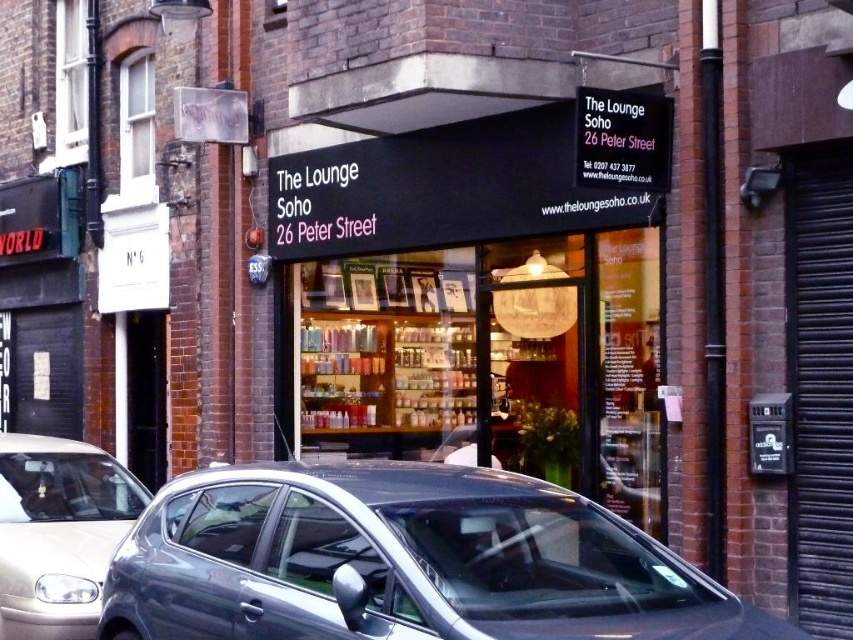
You are standing at the entrance of The Lounge Soho on 26 Peter Street and want to check if your metallic gray hatchback at lower left is within a 4 meter safety zone. Can you confirm if it is within the zone?

The metallic gray hatchback at lower left is 3.99 meters away from the camera, which is within the 4 meter safety zone.

You are a delivery person needing to park your delivery van which is 2 meters wide. You see the metallic gray hatchback at lower left and the silver metallic car at lower left. Can you park your van between them if they are parked side by side?

The metallic gray hatchback at lower left is wider than the silver metallic car at lower left. Since the van is 2 meters wide, you need to check the combined width of both vehicles. However, without knowing their exact widths, it is impossible to determine if there is enough space. Please measure the space before attempting to park.

You are a delivery person needing to park your 2.5 meter long vehicle. You see a metallic gray hatchback at lower left and a silver metallic car at lower left in the parking area. Can you fit your vehicle between them?

The metallic gray hatchback at lower left is located above the silver metallic car at lower left, meaning they are parked one above the other. Since your vehicle is 2.5 meters long, there might not be enough space between them horizontally. Check the distance between the two cars before deciding to park there.